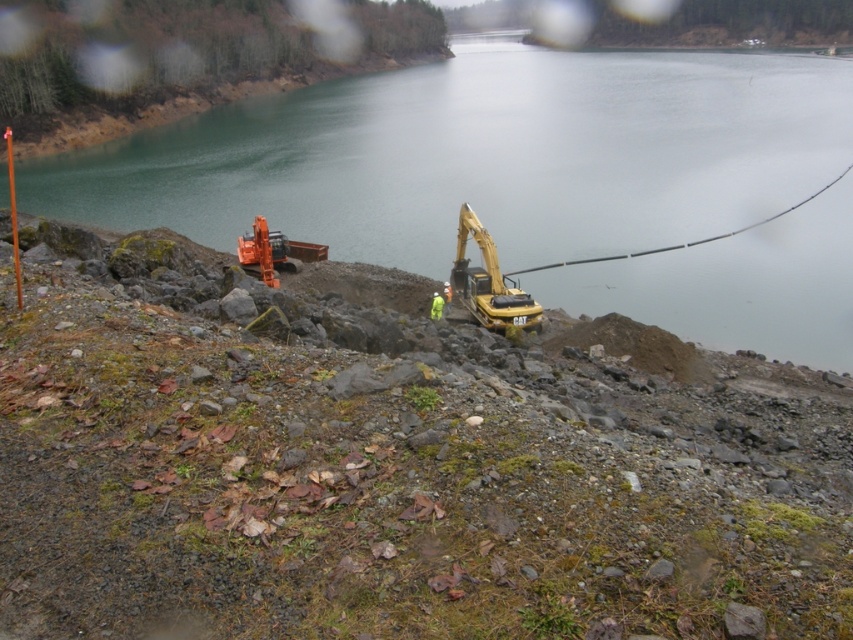
You are a surveyor standing at the origin point of the coordinate system. You need to locate the yellow metallic excavator at center. What are its coordinates?

The yellow metallic excavator at center is located at coordinates point [489,282].

You are a safety inspector assessing the construction site near the greenish water at upper center and the orange metallic excavator at center. Which object occupies a larger area in the image?

The greenish water at upper center is bigger than the orange metallic excavator at center, so it occupies a larger area in the image.

You are a safety inspector assessing the construction site near the water. You notice the greenish water at upper center and the yellow metallic excavator at center. Based on their positions, which object is closer to the water surface?

The greenish water at upper center is above the yellow metallic excavator at center, meaning it is closer to the water surface.